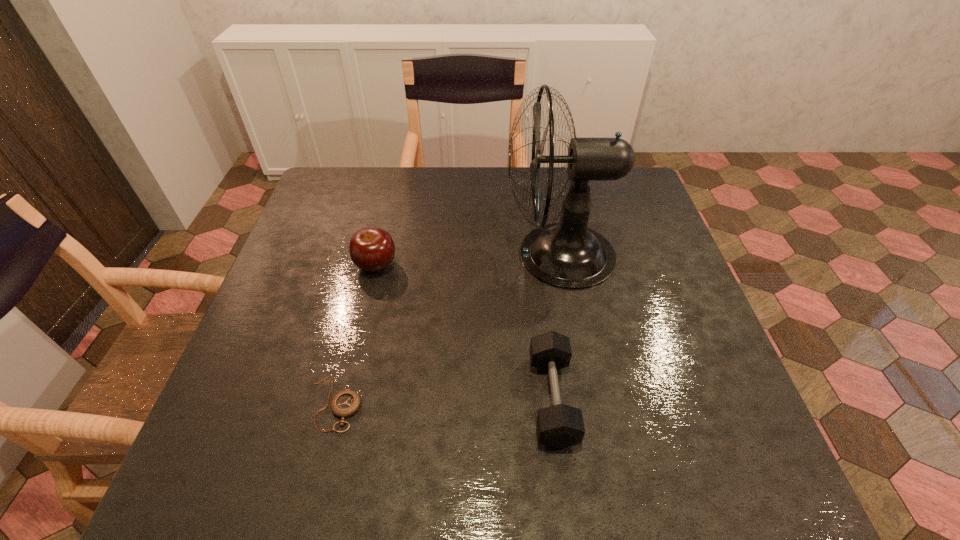
At what (x,y) coordinates should I click in order to perform the action: click on vacant space in between the dumbbell and the shortest object. Please return your answer as a coordinate pair (x, y). This screenshot has height=540, width=960. Looking at the image, I should click on (444, 401).

At what (x,y) coordinates should I click in order to perform the action: click on empty location between the second shortest object and the second tallest object. Please return your answer as a coordinate pair (x, y). Looking at the image, I should click on (464, 332).

I want to click on vacant area between the apple and the fan, so click(468, 260).

The image size is (960, 540). What are the coordinates of `vacant region between the third shortest object and the tallest object` in the screenshot? It's located at (468, 260).

I want to click on empty space between the second shortest object and the pocket watch, so click(x=444, y=401).

Identify the location of vacant region between the third shortest object and the second shortest object. This screenshot has height=540, width=960. (464, 332).

In order to click on vacant area that lies between the pocket watch and the third shortest object in this screenshot , I will do `click(355, 335)`.

The height and width of the screenshot is (540, 960). In order to click on vacant region between the third shortest object and the second shortest object in this screenshot , I will do `click(464, 332)`.

Identify which object is located as the nearest to the pocket watch. Please provide its 2D coordinates. Your answer should be formatted as a tuple, i.e. [(x, y)], where the tuple contains the x and y coordinates of a point satisfying the conditions above.

[(371, 249)]

Find the location of a particular element. Image resolution: width=960 pixels, height=540 pixels. object that is the closest to the third shortest object is located at coordinates (346, 403).